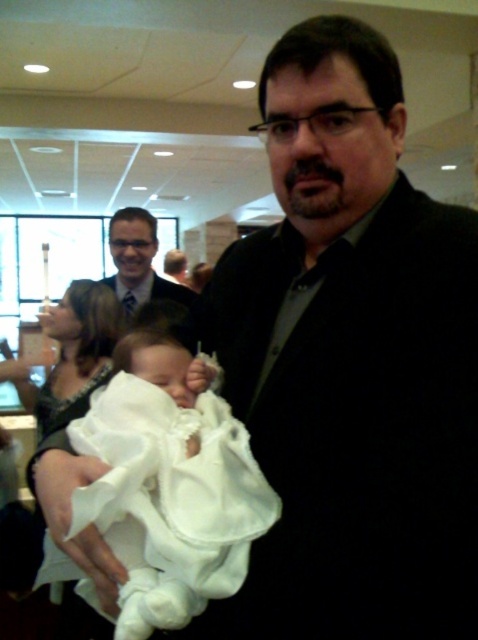
You are standing at the point marked by the coordinates point (185,365). You want to move to the nearest door, which is 40 inches away from you. Can you reach the door without moving more than 40 inches?

The distance between point (185,365) and the viewer is 36.97 inches. Since the nearest door is 40 inches away, you can reach it without moving more than 40 inches because 36.97 is less than 40.

Looking at this image, you are a photographer at this event and need to ensure that both the white satin baby at center and the matte black suit at center are clearly visible in your photo. Given their sizes, which object might require you to adjust your camera focus more carefully to avoid blurriness?

The white satin baby at center is shorter than the matte black suit at center, so the baby might require more careful focus adjustment to ensure clarity since it is smaller in size.

In the scene shown: Based on the scene description, where exactly is the white satin baby at center located in terms of coordinates?

The white satin baby at center is located at point (169, 486).